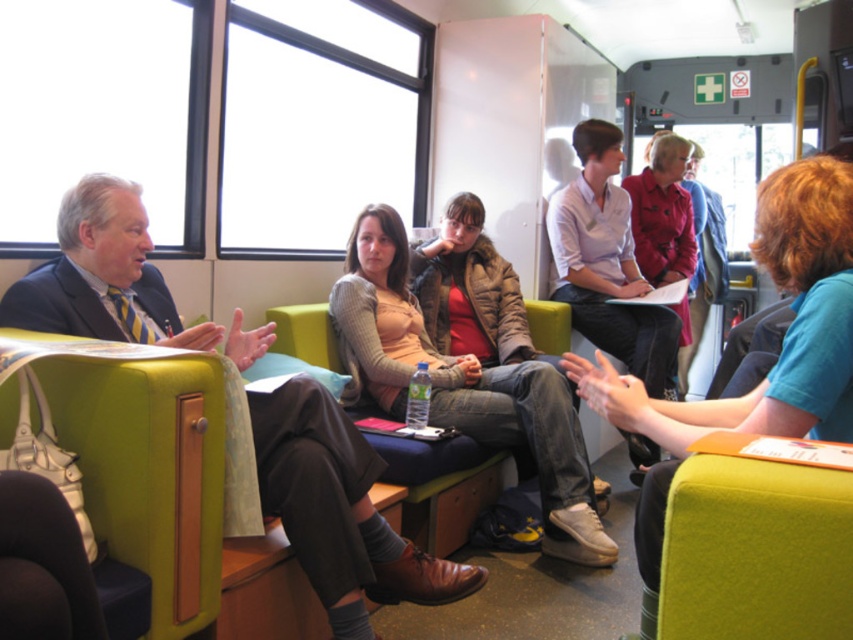
You are standing in the train and want to sit down. You see the green felt chair at lower right and the matte red coat at center. Which one has more space available for you to sit?

The matte red coat at center occupies more space than the green felt chair at lower right, so it has more space available for sitting.

What is located at the coordinates point (x=773, y=364)?

The blue cotton shirt at center is located at point (x=773, y=364).

You are a passenger on a train and you see two people sitting across from you. One is wearing a blue cotton shirt at center and the other is wearing a matte red coat at center. Which of the two is shorter?

The blue cotton shirt at center is shorter than the matte red coat at center.